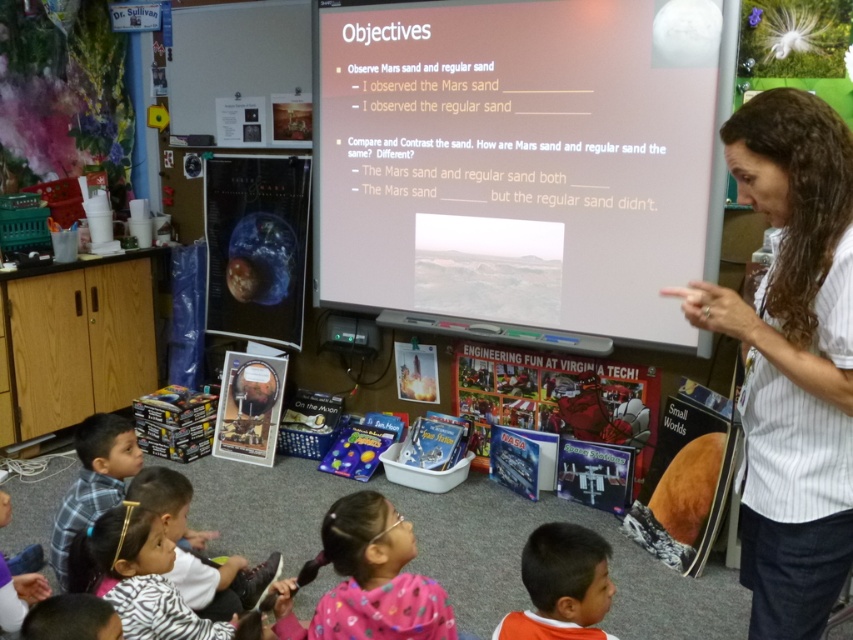
You are a student in the classroom looking at the teacher. Which object is closer to you between the orange fabric shirt at lower center and the pink fabric at lower center?

The pink fabric at lower center is closer to you because the orange fabric shirt at lower center is behind it.

You are a student sitting at your desk in the classroom. You notice two points marked on the projection screen. The first point is at coordinate point (747, 465) and the second is at point (569, 621). Which point is closer to you?

Point (747, 465) is in front of point (569, 621), so the first point is closer to you.